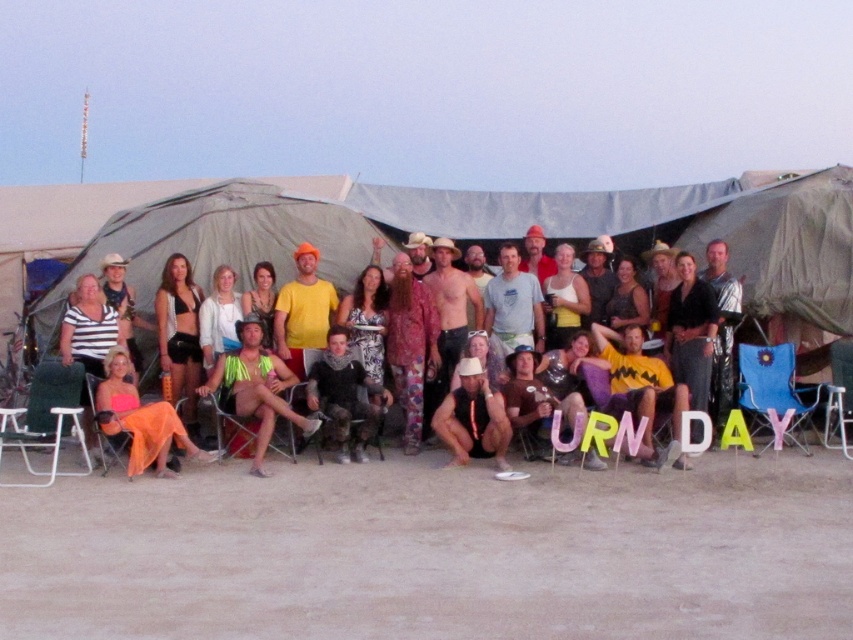
You are standing at the edge of the sandy area and want to sit down. The smooth sand at lower center and the metallic silver beach chair at lower right are both available. Which one is closer to you?

The smooth sand at lower center is closer to the viewer than the metallic silver beach chair at lower right, so you can sit there first.

You are a photographer trying to capture a photo of the matte black shirt at center and the metallic silver beach chair at lower right. Since you want both objects to appear the same size in the photo, which one should you move closer to?

The matte black shirt at center is smaller than the metallic silver beach chair at lower right. To make them appear the same size in the photo, you should move closer to the matte black shirt at center.